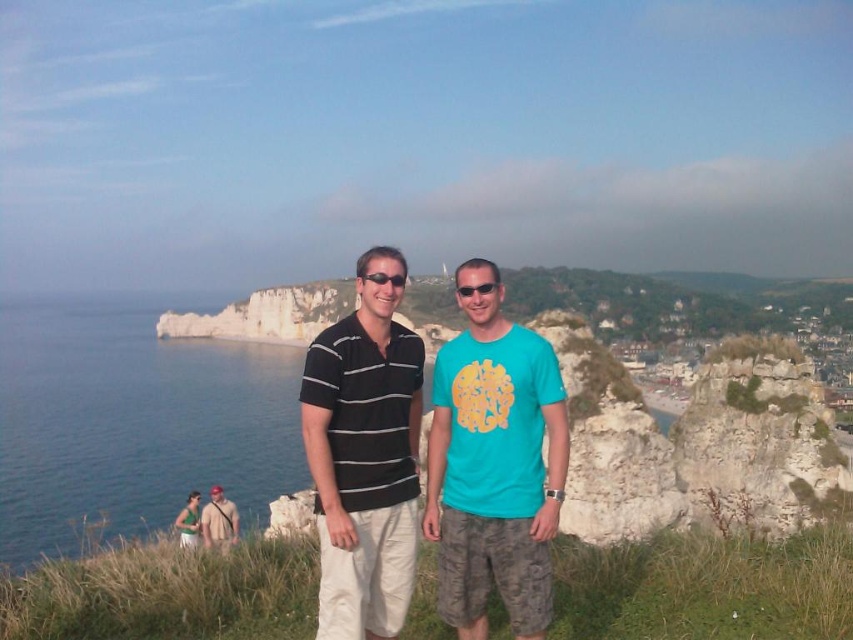
Is black striped polo shirt at center to the left of camouflage shorts at lower left from the viewer's perspective?

Incorrect, black striped polo shirt at center is not on the left side of camouflage shorts at lower left.

Does black striped polo shirt at center have a smaller size compared to camouflage shorts at lower left?

Answer: Yes.

The width and height of the screenshot is (853, 640). Describe the element at coordinates (364, 458) in the screenshot. I see `black striped polo shirt at center` at that location.

Locate an element on the screen. black striped polo shirt at center is located at coordinates (364, 458).

Does point (370, 374) come closer to viewer compared to point (189, 532)?

Yes.

Which of these two, black striped polo shirt at center or green fabric dress at lower left, stands taller?

With more height is black striped polo shirt at center.

Find the location of `black striped polo shirt at center`. black striped polo shirt at center is located at coordinates (364, 458).

In the scene shown: Can you confirm if teal matte t-shirt at center is smaller than green fabric dress at lower left?

Correct, teal matte t-shirt at center occupies less space than green fabric dress at lower left.

Can you confirm if teal matte t-shirt at center is bigger than green fabric dress at lower left?

Incorrect, teal matte t-shirt at center is not larger than green fabric dress at lower left.

Is point (505, 518) in front of point (194, 520)?

That is True.

At what (x,y) coordinates should I click in order to perform the action: click on teal matte t-shirt at center. Please return your answer as a coordinate pair (x, y). Looking at the image, I should click on (494, 465).